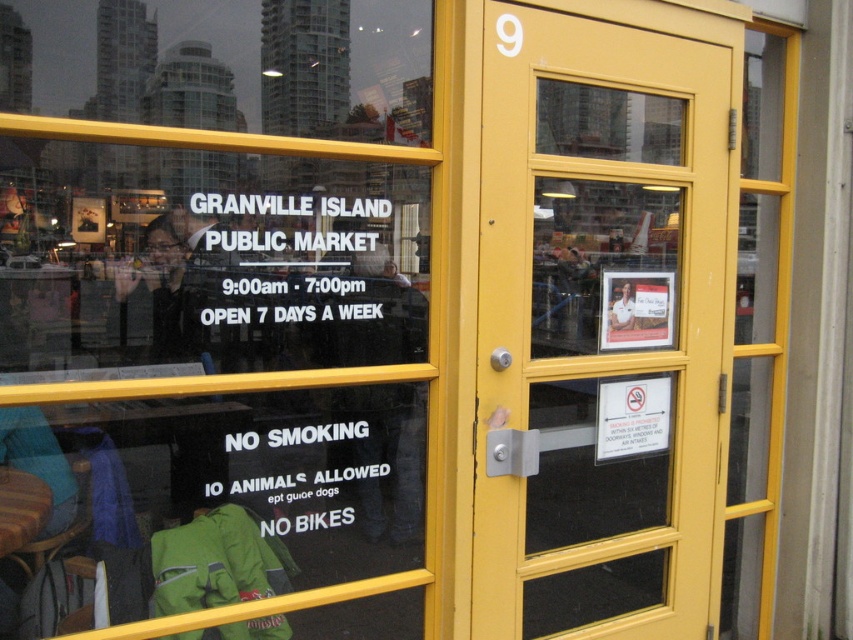
Is yellow glass door at center taller than white paper sign at lower center?

Yes, yellow glass door at center is taller than white paper sign at lower center.

Can you confirm if yellow glass door at center is thinner than white paper sign at lower center?

No.

Measure the distance between point (679, 198) and camera.

Point (679, 198) and camera are 8.92 feet apart from each other.

Identify the location of yellow glass door at center. This screenshot has width=853, height=640. (x=601, y=321).

Between white paper sign at lower center and white paper sign at upper center, which one is positioned lower?

Positioned lower is white paper sign at lower center.

The image size is (853, 640). What do you see at coordinates (312, 474) in the screenshot? I see `white paper sign at lower center` at bounding box center [312, 474].

Between point (386, 444) and point (264, 250), which one is positioned in front?

Positioned in front is point (264, 250).

Find the location of a particular element. Image resolution: width=853 pixels, height=640 pixels. white paper sign at lower center is located at coordinates (312, 474).

Does yellow glass door at center lie behind white paper sign at upper center?

That is True.

Can you confirm if yellow glass door at center is wider than white paper sign at upper center?

Indeed, yellow glass door at center has a greater width compared to white paper sign at upper center.

The image size is (853, 640). I want to click on yellow glass door at center, so click(x=601, y=321).

Image resolution: width=853 pixels, height=640 pixels. I want to click on yellow glass door at center, so click(x=601, y=321).